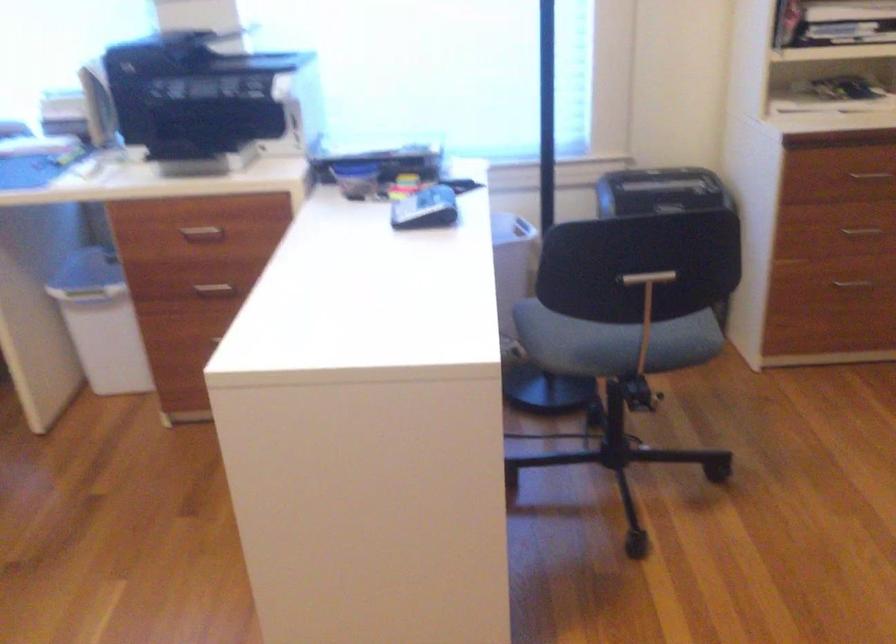
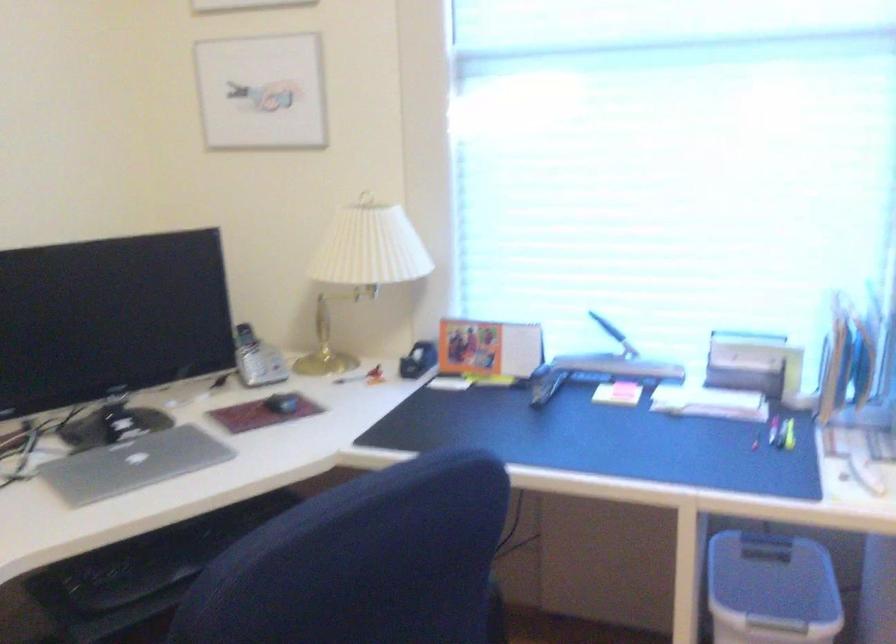
Which direction would the cameraman need to move to produce the second image?

The cameraman moved toward left, forward.